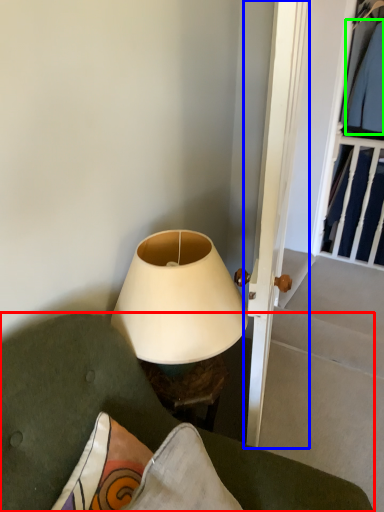
Question: Which object is the closest to the furniture (highlighted by a red box)? Choose among these: door (highlighted by a blue box) or clothing (highlighted by a green box).

Choices:
 (A) door
 (B) clothing

Answer: (A)